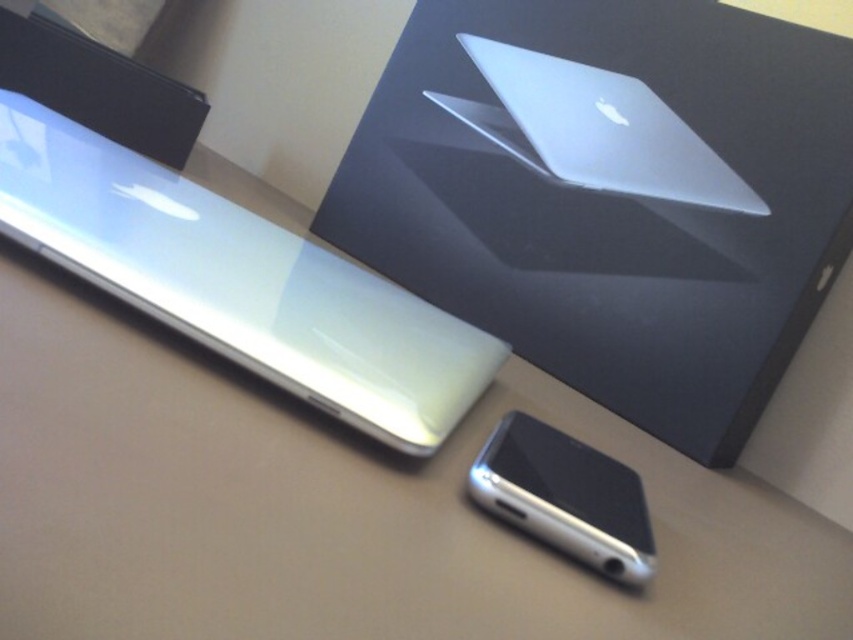
Which is below, glossy white tablet at upper left or silver metallic smartphone at lower center?

silver metallic smartphone at lower center

Is point (364, 301) less distant than point (618, 536)?

No, (364, 301) is behind (618, 536).

You are a GUI agent. You are given a task and a screenshot of the screen. Output one action in this format:
    pyautogui.click(x=<x>, y=<y>)
    Task: Click on the glossy white tablet at upper left
    The height and width of the screenshot is (640, 853).
    Given the screenshot: What is the action you would take?
    pyautogui.click(x=239, y=282)

Between point (503, 134) and point (628, 552), which one is positioned in front?

Positioned in front is point (628, 552).

Is point (547, 113) less distant than point (537, 440)?

No, (547, 113) is further to viewer.

Is point (705, 188) farther from viewer compared to point (572, 508)?

Yes, point (705, 188) is behind point (572, 508).

In order to click on silver metallic laptop at upper right in this screenshot , I will do `click(599, 131)`.

Between glossy white tablet at upper left and silver metallic laptop at upper right, which one appears on the left side from the viewer's perspective?

glossy white tablet at upper left is more to the left.

Can you confirm if glossy white tablet at upper left is positioned to the left of silver metallic laptop at upper right?

Indeed, glossy white tablet at upper left is positioned on the left side of silver metallic laptop at upper right.

Looking at this image, who is more forward, [54,193] or [460,38]?

Point [54,193] is in front.

You are a GUI agent. You are given a task and a screenshot of the screen. Output one action in this format:
    pyautogui.click(x=<x>, y=<y>)
    Task: Click on the glossy white tablet at upper left
    
    Given the screenshot: What is the action you would take?
    pyautogui.click(x=239, y=282)